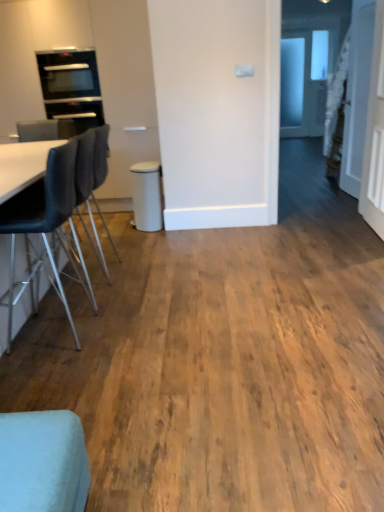
Question: Does point (16, 495) appear closer or farther from the camera than point (364, 6)?

Choices:
 (A) closer
 (B) farther

Answer: (A)

Question: Is light blue fabric chair at lower left, which ranks as the third chair in back-to-front order, to the left or to the right of white glossy door at upper right in the image?

Choices:
 (A) left
 (B) right

Answer: (A)

Question: Considering the real-world distances, which object is closest to the black leather chair at left, the 2th chair from the front?

Choices:
 (A) light blue fabric chair at lower left, marked as the first chair in a front-to-back arrangement
 (B) black glass oven at upper left
 (C) black leather chair at left, the 3th chair in the front-to-back sequence
 (D) matte white bar stool at center
 (E) white glossy door at upper right

Answer: (C)

Question: Which of these objects is positioned closest to the matte white bar stool at center?

Choices:
 (A) light blue fabric chair at lower left, which ranks as the third chair in back-to-front order
 (B) white glossy door at upper right
 (C) black glass oven at upper left
 (D) black leather chair at left, the 2th chair from the front
 (E) black leather chair at left, the first chair from the back

Answer: (E)